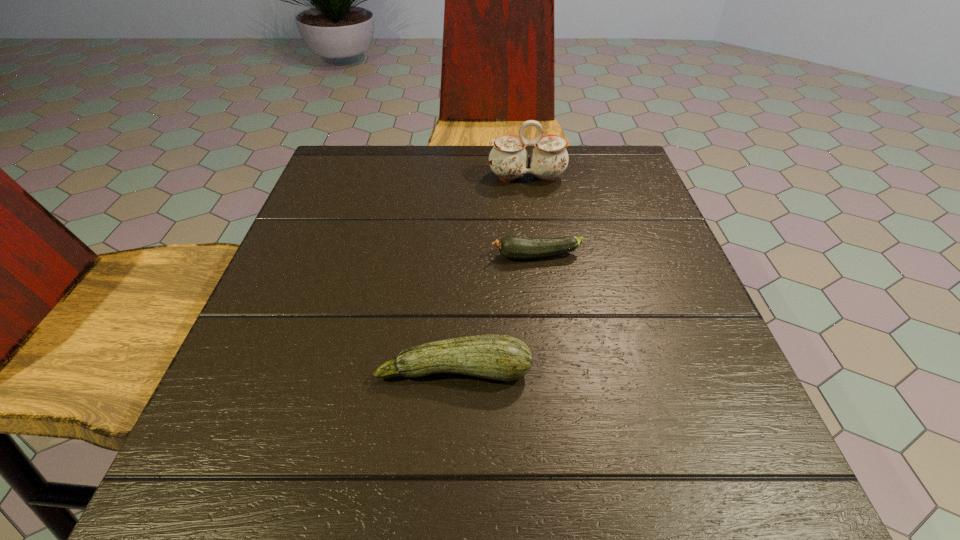
Image resolution: width=960 pixels, height=540 pixels. What are the coordinates of `vacant space that's between the farther zucchini and the nearest object` in the screenshot? It's located at (495, 313).

Identify the location of free space that is in between the shortest object and the taller zucchini. (495, 313).

Where is `free space between the farthest object and the second nearest object`? free space between the farthest object and the second nearest object is located at coordinates (532, 217).

I want to click on empty space between the nearest object and the chinaware, so click(x=491, y=273).

Locate an element on the screen. This screenshot has height=540, width=960. free spot between the taller zucchini and the shorter zucchini is located at coordinates (495, 313).

Find the location of a particular element. The width and height of the screenshot is (960, 540). vacant area that lies between the shorter zucchini and the farthest object is located at coordinates (532, 217).

Where is `vacant region between the farthest object and the shorter zucchini`? The width and height of the screenshot is (960, 540). vacant region between the farthest object and the shorter zucchini is located at coordinates (532, 217).

This screenshot has width=960, height=540. In order to click on free space between the shortest object and the tallest object in this screenshot , I will do `click(532, 217)`.

In order to click on free spot between the second tallest object and the shortest object in this screenshot , I will do `click(495, 313)`.

Locate which object is the closest to the second farthest object. Please provide its 2D coordinates. Your answer should be formatted as a tuple, i.e. [(x, y)], where the tuple contains the x and y coordinates of a point satisfying the conditions above.

[(501, 357)]